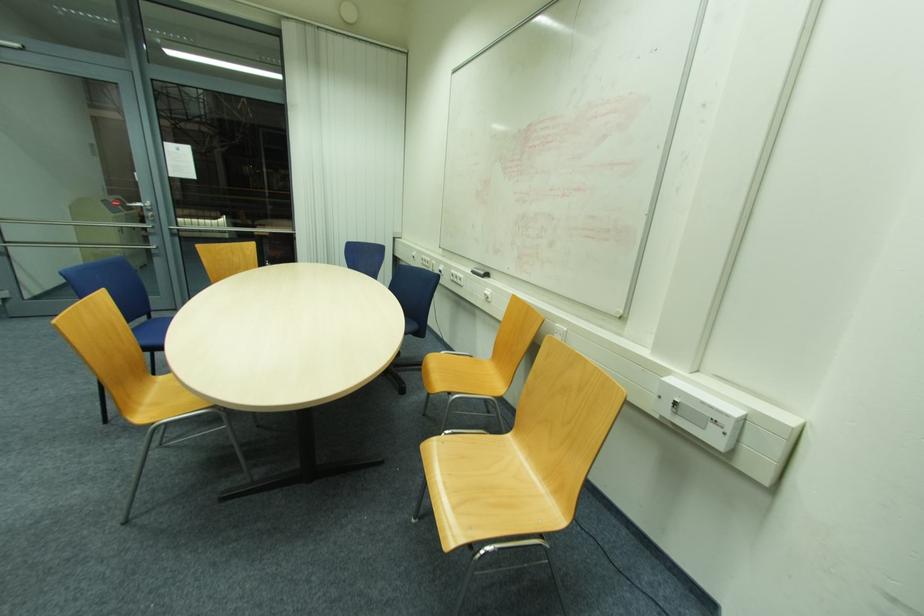
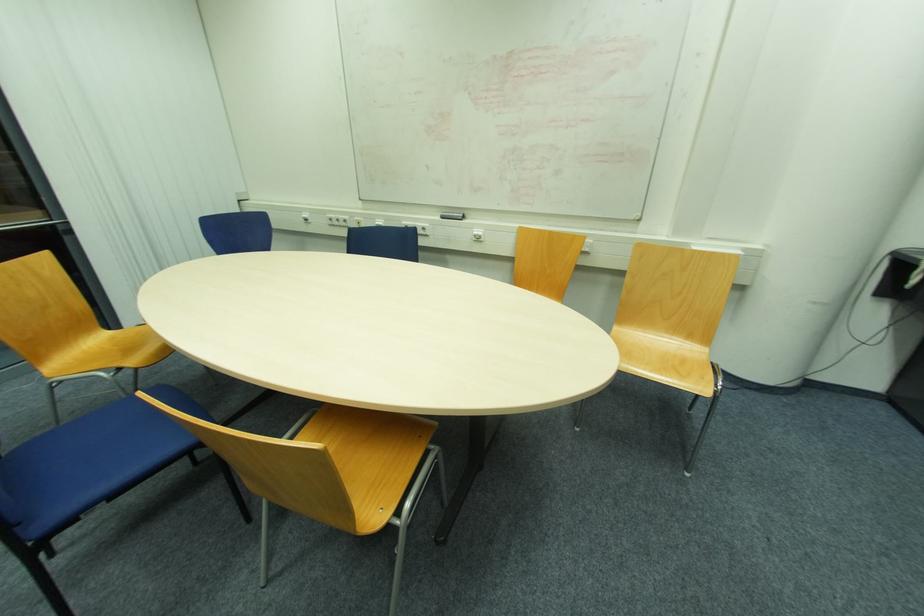
The point at [475,273] is marked in the first image. Where is the corresponding point in the second image?

(444, 217)